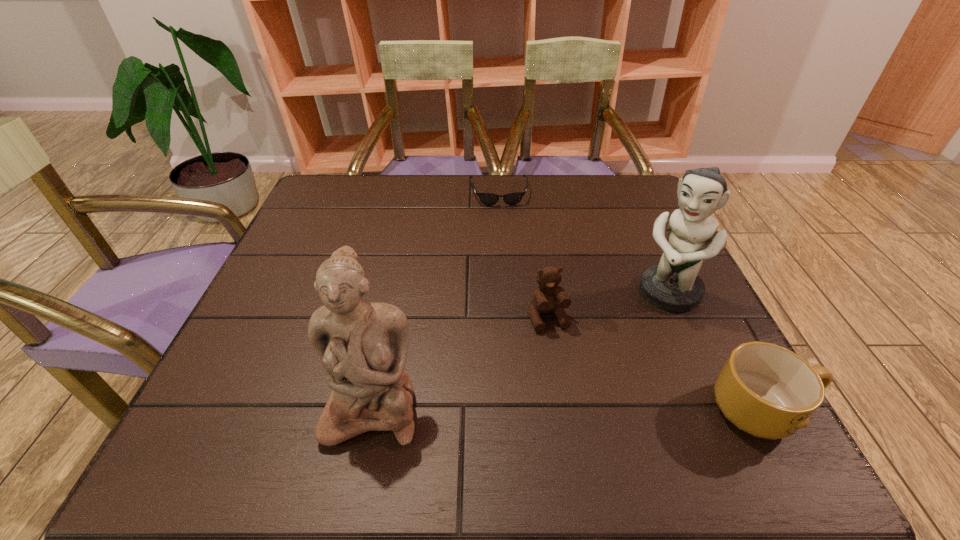
Find the location of `figurine that is positioned at the right edge`. figurine that is positioned at the right edge is located at coordinates (673, 285).

Where is `object at the near right corner`? The height and width of the screenshot is (540, 960). object at the near right corner is located at coordinates (768, 391).

The width and height of the screenshot is (960, 540). Find the location of `free space at the far edge`. free space at the far edge is located at coordinates (371, 192).

Where is `vacant position at the near edge of the desktop`? The image size is (960, 540). vacant position at the near edge of the desktop is located at coordinates (477, 401).

At what (x,y) coordinates should I click in order to perform the action: click on vacant space at the left edge. Please return your answer as a coordinate pair (x, y). The height and width of the screenshot is (540, 960). Looking at the image, I should click on (257, 316).

You are a GUI agent. You are given a task and a screenshot of the screen. Output one action in this format:
    pyautogui.click(x=<x>, y=<y>)
    Task: Click on the free space at the right edge of the desktop
    The image size is (960, 540).
    Given the screenshot: What is the action you would take?
    pyautogui.click(x=674, y=322)

Locate an element on the screen. vacant space at the far left corner of the desktop is located at coordinates (361, 219).

Find the location of a particular element. The image size is (960, 540). vacant space at the far right corner of the desktop is located at coordinates (631, 219).

In the image, there is a desktop. Where is `free space at the near right corner`? The width and height of the screenshot is (960, 540). free space at the near right corner is located at coordinates (664, 399).

Find the location of a particular element. This screenshot has width=960, height=540. free point between the shortest object and the farther figurine is located at coordinates (584, 242).